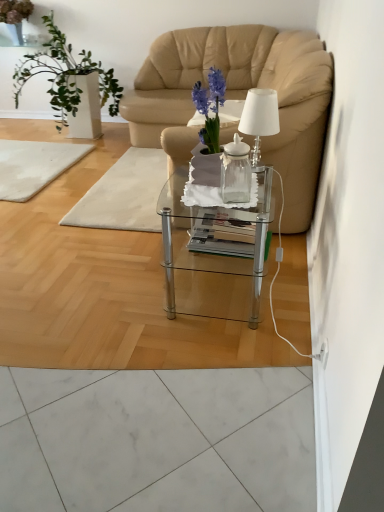
Question: In the image, is translucent glass table at center, acting as the 2th mat starting from the left, positioned in front of or behind clear glass coffee table at center?

Choices:
 (A) behind
 (B) front

Answer: (A)

Question: From the image's perspective, is translucent glass table at center, the 1th mat in the right-to-left sequence, positioned above or below clear glass coffee table at center?

Choices:
 (A) above
 (B) below

Answer: (A)

Question: Estimate the real-world distances between objects in this image. Which object is farther from the white marble mat at left, the 1th mat positioned from the left?

Choices:
 (A) white glossy vase at left
 (B) beige leather armchair at center
 (C) clear glass coffee table at center
 (D) white glass table lamp at upper right
 (E) translucent glass table at center, the 1th mat in the right-to-left sequence

Answer: (D)

Question: Which object is positioned closest to the white marble mat at left, the 1th mat positioned from the left?

Choices:
 (A) beige leather armchair at center
 (B) white glossy vase at left
 (C) transparent glass vase at center
 (D) clear glass coffee table at center
 (E) translucent glass table at center, acting as the 2th mat starting from the left

Answer: (E)